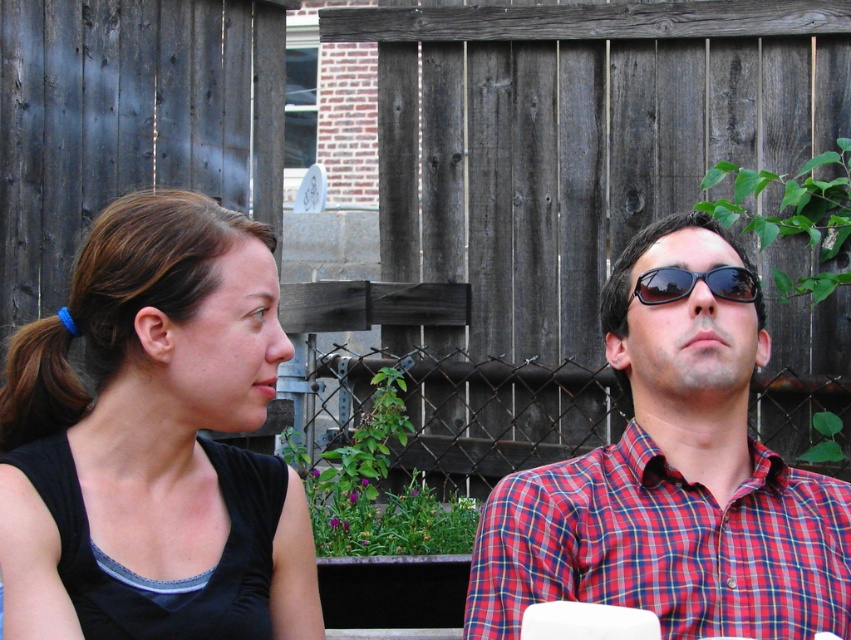
You are a photographer trying to capture a candid shot of the two people in the scene. You want to ensure that the black fabric at left and the black matte shirt at center are both visible in the frame. Based on their positions, which object is closer to the camera?

The black matte shirt at center is closer to the camera because the black fabric at left is behind it.

You are planning to take a photo of the black fabric at left and the plaid shirt at center. Which object should you zoom in on to capture more details without changing the camera position?

The black fabric at left should be zoomed in on because it has a smaller size compared to the plaid shirt at center, so zooming in on it would allow capturing more details without changing the camera position.

You are trying to decide whether to place a decorative item between the black fabric at left and the black reflective sunglasses at upper center. Which object should you place the item closer to if you want it to be near the wider object?

The black fabric at left is wider than the black reflective sunglasses at upper center, so place the item closer to the black fabric at left.